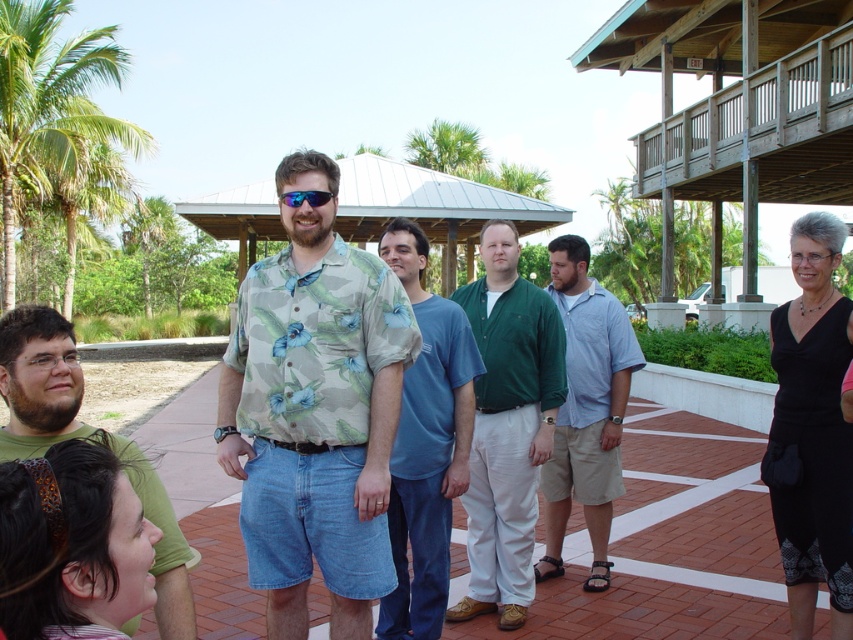
Image resolution: width=853 pixels, height=640 pixels. I want to click on blue cotton shirt at center, so click(x=426, y=444).

You are a GUI agent. You are given a task and a screenshot of the screen. Output one action in this format:
    pyautogui.click(x=<x>, y=<y>)
    Task: Click on the blue cotton shirt at center
    
    Given the screenshot: What is the action you would take?
    pyautogui.click(x=426, y=444)

Is the position of floral print shirt at center more distant than that of green leafy palm tree at upper left?

No, floral print shirt at center is in front of green leafy palm tree at upper left.

Is point (230, 340) in front of point (19, 120)?

Yes.

You are a GUI agent. You are given a task and a screenshot of the screen. Output one action in this format:
    pyautogui.click(x=<x>, y=<y>)
    Task: Click on the floral print shirt at center
    
    Given the screenshot: What is the action you would take?
    [x=315, y=412]

Between point (73, 372) and point (283, 193), which one is positioned behind?

The point (283, 193) is more distant.

Which of these two, green cotton shirt at lower left or blue reflective lens sunglasses at center, stands shorter?

With less height is blue reflective lens sunglasses at center.

What do you see at coordinates (38, 381) in the screenshot? I see `green cotton shirt at lower left` at bounding box center [38, 381].

This screenshot has height=640, width=853. Identify the location of green cotton shirt at lower left. (38, 381).